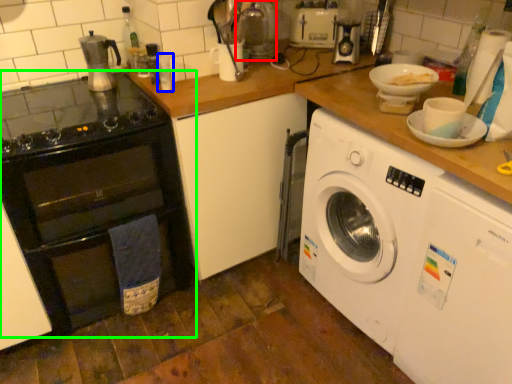
Question: Estimate the real-world distances between objects in this image. Which object is closer to appliance (highlighted by a red box), bottle (highlighted by a blue box) or oven (highlighted by a green box)?

Choices:
 (A) bottle
 (B) oven

Answer: (A)